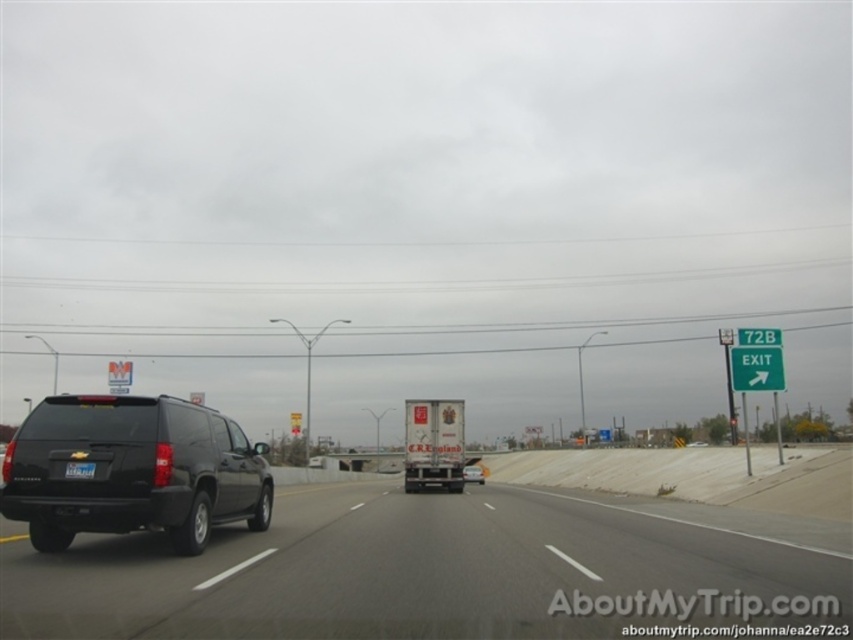
Consider the image. Is matte black suv at left smaller than black matte suv at center?

Actually, matte black suv at left might be larger than black matte suv at center.

The image size is (853, 640). Describe the element at coordinates (132, 470) in the screenshot. I see `matte black suv at left` at that location.

Find the location of a particular element. The width and height of the screenshot is (853, 640). matte black suv at left is located at coordinates (132, 470).

You are a GUI agent. You are given a task and a screenshot of the screen. Output one action in this format:
    pyautogui.click(x=<x>, y=<y>)
    Task: Click on the matte black suv at left
    Image resolution: width=853 pixels, height=640 pixels.
    Given the screenshot: What is the action you would take?
    pyautogui.click(x=132, y=470)

Is point (90, 426) in front of point (473, 465)?

Yes.

Does matte black suv at left have a smaller size compared to white glossy truck at center?

Indeed, matte black suv at left has a smaller size compared to white glossy truck at center.

Is point (15, 493) behind point (482, 476)?

No, it is in front of (482, 476).

Find the location of `matte black suv at left`. matte black suv at left is located at coordinates (132, 470).

Does matte black suv at left appear under green plastic exit sign at upper right?

Yes.

Who is lower down, matte black suv at left or green plastic exit sign at upper right?

matte black suv at left is lower down.

Is point (228, 502) positioned after point (776, 349)?

That is False.

Image resolution: width=853 pixels, height=640 pixels. What are the coordinates of `matte black suv at left` in the screenshot? It's located at (132, 470).